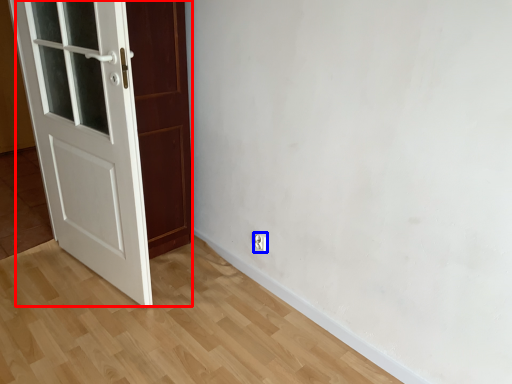
Question: Which object is further to the camera taking this photo, door (highlighted by a red box) or electric outlet (highlighted by a blue box)?

Choices:
 (A) door
 (B) electric outlet

Answer: (B)